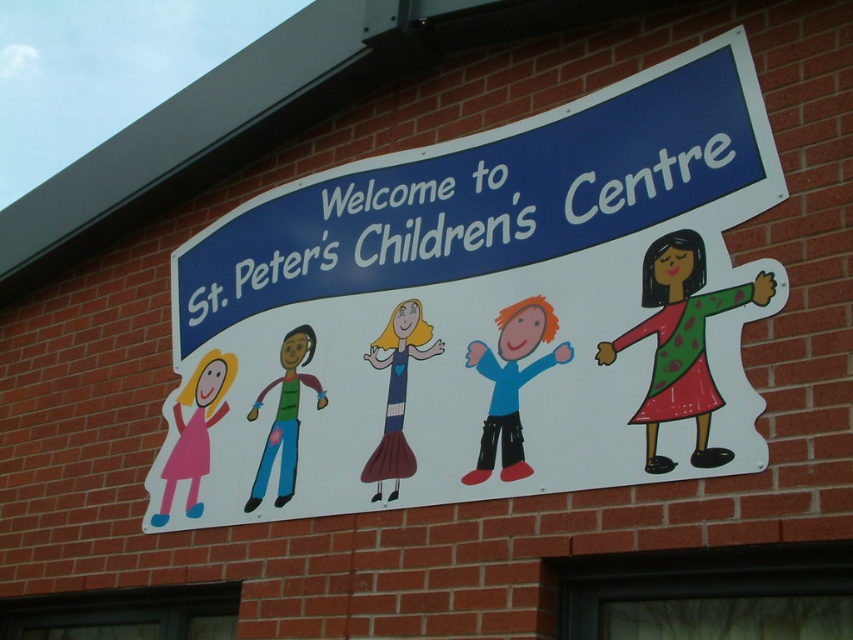
You are a tailor who needs to determine which clothing item requires more fabric for a new order. Based on the image, which clothing item between the matte blue dress at center and the matte green shirt at center would need more fabric?

The matte green shirt at center requires more fabric since it is thicker than the matte blue dress at center.

You are a designer reviewing the signboard for St. Peter Children Center. You need to ensure that the two central elements, the matte blue dress at center and the matte green shirt at center, are balanced in size. Based on the description, which element should be adjusted to achieve better balance?

The matte blue dress at center occupies less space than the matte green shirt at center. To achieve better balance, the matte blue dress at center should be enlarged to match the size of the matte green shirt at center.